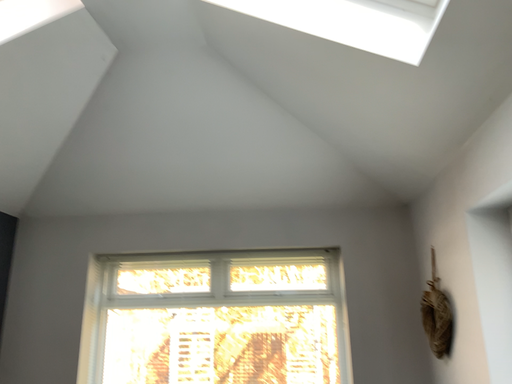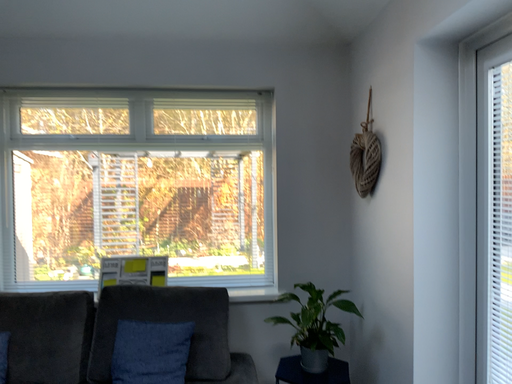
Question: How did the camera likely rotate when shooting the video?

Choices:
 (A) rotated upward
 (B) rotated downward

Answer: (B)